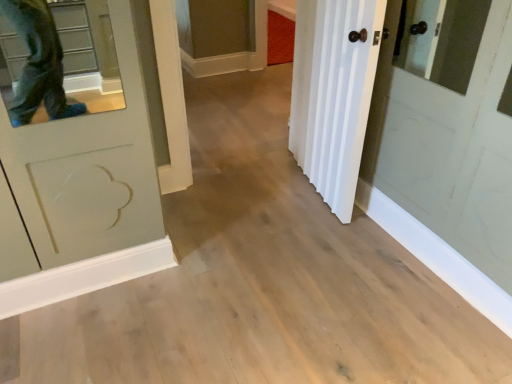
Image resolution: width=512 pixels, height=384 pixels. What do you see at coordinates (333, 93) in the screenshot?
I see `white wood door at center` at bounding box center [333, 93].

I want to click on white wood door at center, so click(333, 93).

Where is `white matte cabinet at upper center`? white matte cabinet at upper center is located at coordinates (222, 36).

What do you see at coordinates (222, 36) in the screenshot?
I see `white matte cabinet at upper center` at bounding box center [222, 36].

Where is `white wood door at center`? Image resolution: width=512 pixels, height=384 pixels. white wood door at center is located at coordinates (333, 93).

Considering the relative positions of white matte cabinet at upper center and white wood door at center in the image provided, is white matte cabinet at upper center to the right of white wood door at center from the viewer's perspective?

No, white matte cabinet at upper center is not to the right of white wood door at center.

In the image, is white matte cabinet at upper center positioned in front of or behind white wood door at center?

In the image, white matte cabinet at upper center appears behind white wood door at center.

Which is further, (213, 60) or (290, 117)?

The point (213, 60) is behind.

From the image's perspective, is white matte cabinet at upper center below white wood door at center?

No.

From a real-world perspective, is white matte cabinet at upper center beneath white wood door at center?

Yes, from a real-world perspective, white matte cabinet at upper center is beneath white wood door at center.

In the scene shown: Can you confirm if white matte cabinet at upper center is thinner than white wood door at center?

No.

Considering the sizes of objects white matte cabinet at upper center and white wood door at center in the image provided, who is taller, white matte cabinet at upper center or white wood door at center?

white wood door at center is taller.

Can you confirm if white matte cabinet at upper center is bigger than white wood door at center?

Yes, white matte cabinet at upper center is bigger than white wood door at center.

Is white matte cabinet at upper center completely or partially outside of white wood door at center?

Yes, white matte cabinet at upper center is not within white wood door at center.

Is the surface of white matte cabinet at upper center in direct contact with white wood door at center?

No, white matte cabinet at upper center is not next to white wood door at center.

Is white matte cabinet at upper center oriented away from white wood door at center?

That's not correct — white matte cabinet at upper center is not looking away from white wood door at center.

Can you tell me how much white matte cabinet at upper center and white wood door at center differ in facing direction?

The facing directions of white matte cabinet at upper center and white wood door at center are 9.43 degrees apart.

Locate an element on the screen. The height and width of the screenshot is (384, 512). door to the right of white matte cabinet at upper center is located at coordinates (333, 93).

Which is more to the left, white wood door at center or white matte cabinet at upper center?

white matte cabinet at upper center is more to the left.

Is white wood door at center positioned before white matte cabinet at upper center?

That is True.

Is point (350, 89) farther from viewer compared to point (210, 28)?

No, (350, 89) is in front of (210, 28).

From the image's perspective, relative to white matte cabinet at upper center, is white wood door at center above or below?

white wood door at center is situated lower than white matte cabinet at upper center in the image.

From a real-world perspective, is white wood door at center on top of white matte cabinet at upper center?

Yes.

Can you confirm if white wood door at center is wider than white matte cabinet at upper center?

No.

Which of these two, white wood door at center or white matte cabinet at upper center, stands shorter?

Standing shorter between the two is white matte cabinet at upper center.

Is white wood door at center smaller than white matte cabinet at upper center?

Yes, white wood door at center is smaller than white matte cabinet at upper center.

Is white wood door at center surrounding white matte cabinet at upper center?

No.

Would you say white wood door at center is a long distance from white matte cabinet at upper center?

Absolutely, white wood door at center is distant from white matte cabinet at upper center.

Is white matte cabinet at upper center at the back of white wood door at center?

No, white matte cabinet at upper center is not at the back of white wood door at center.

What's the angular difference between white wood door at center and white matte cabinet at upper center's facing directions?

9.43 degrees separate the facing orientations of white wood door at center and white matte cabinet at upper center.

How distant is white wood door at center from white matte cabinet at upper center?

white wood door at center and white matte cabinet at upper center are 2.01 meters apart.

The width and height of the screenshot is (512, 384). I want to click on cabinetry behind the white wood door at center, so click(222, 36).

Identify the location of cabinetry located underneath the white wood door at center (from a real-world perspective). Image resolution: width=512 pixels, height=384 pixels. (222, 36).

Locate an element on the screen. This screenshot has width=512, height=384. door that appears on the right of white matte cabinet at upper center is located at coordinates pyautogui.click(x=333, y=93).